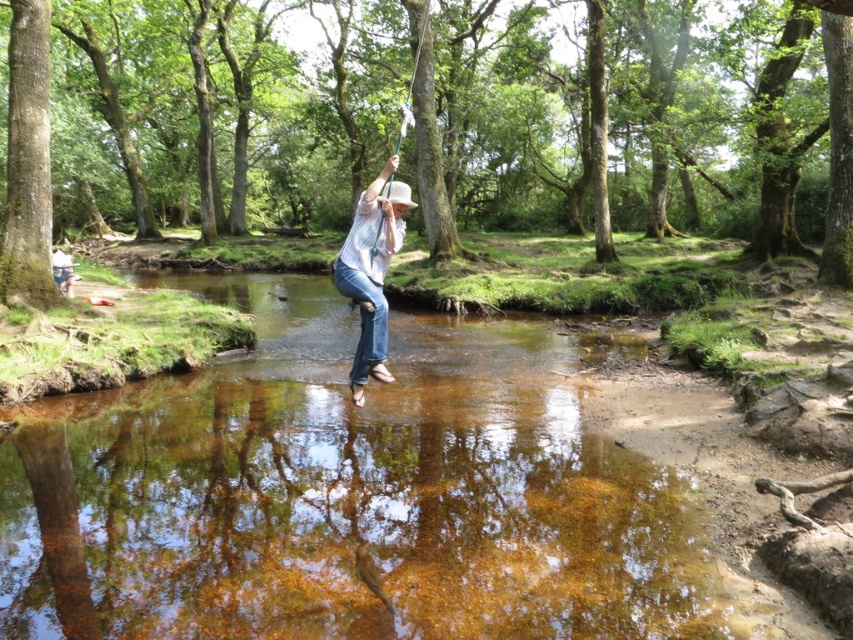
You are planning to hang a new swing on the green rough bark tree at left and the white cotton shirt at center. Based on their widths, which object is more suitable for supporting the swing?

The white cotton shirt at center has a greater width than the green rough bark tree at left, making it more suitable for supporting the swing.

You are planning to hang a hammock between the green smooth bark tree at center and the green rough bark tree at left. Considering their widths, which tree would provide a more stable anchor point for the hammock?

The green smooth bark tree at center has a larger width than the green rough bark tree at left, making it a more stable anchor point for the hammock.

You are standing in the forest and see the green smooth bark tree at center and the white cotton shirt at center. Which object is positioned more to the left?

The green smooth bark tree at center is positioned to the left of the white cotton shirt at center, so it is more to the left.